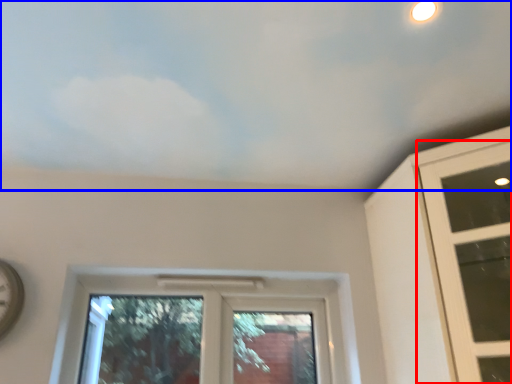
Question: Which object is further to the camera taking this photo, window (highlighted by a red box) or cloud (highlighted by a blue box)?

Choices:
 (A) window
 (B) cloud

Answer: (A)